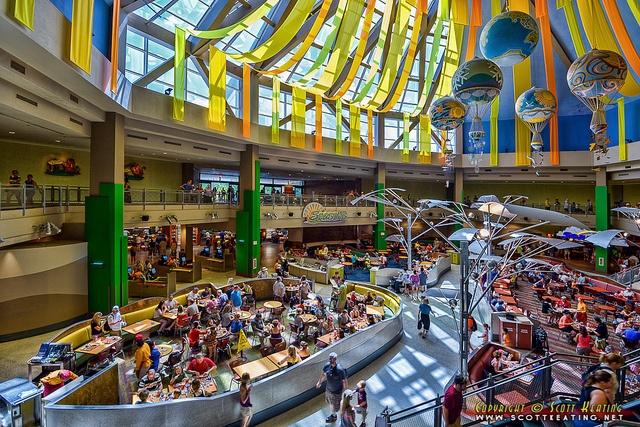
At what (x,y) coordinates should I click in order to perform the action: click on window. Please return your answer as a coordinate pair (x, y). This screenshot has height=427, width=640. Looking at the image, I should click on (262, 107).